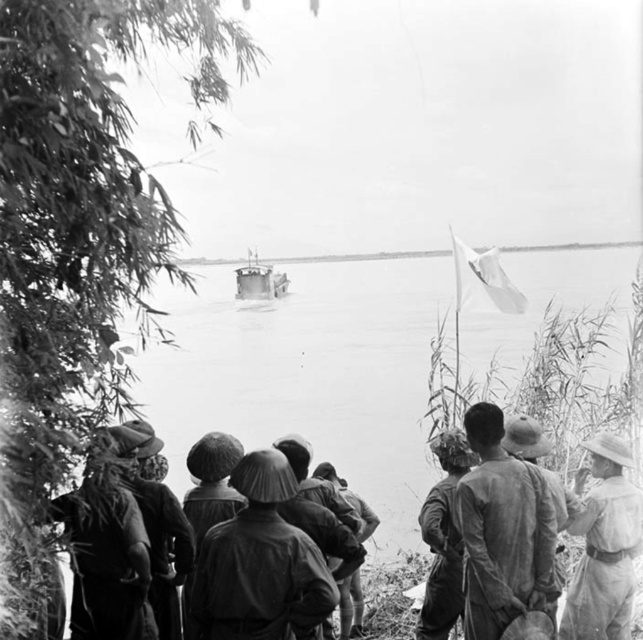
Question: Can you confirm if light brown fabric hat at right is wider than camouflage fabric hat at center?

Choices:
 (A) yes
 (B) no

Answer: (A)

Question: Among these points, which one is farthest from the camera?

Choices:
 (A) (320, 500)
 (B) (269, 541)

Answer: (A)

Question: Is light brown fabric hat at right smaller than metallic gray boat at center?

Choices:
 (A) no
 (B) yes

Answer: (B)

Question: Which point is closer to the camera?

Choices:
 (A) rough fabric shirt at center
 (B) matte brown helmet at center

Answer: (B)

Question: Is matte brown helmet at center closer to the viewer compared to rough fabric shirt at center?

Choices:
 (A) no
 (B) yes

Answer: (B)

Question: Which of these objects is positioned farthest from the camouflage fabric hat at center?

Choices:
 (A) light brown fabric hat at right
 (B) metallic gray boat at center

Answer: (B)